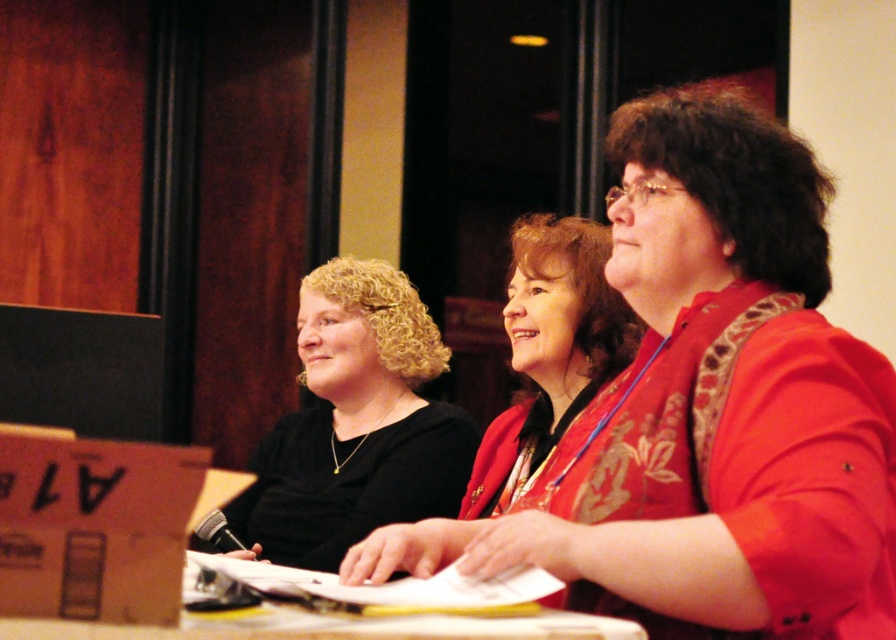
Measure the distance from matte red jacket at center to white glossy table at lower center.

matte red jacket at center is 76.67 centimeters from white glossy table at lower center.

Is point (541, 248) farther from viewer compared to point (214, 621)?

Yes, point (541, 248) is farther from viewer.

Identify the location of matte red jacket at center. (550, 349).

Who is shorter, black matte shirt at center or matte red jacket at center?

Standing shorter between the two is matte red jacket at center.

The width and height of the screenshot is (896, 640). In order to click on black matte shirt at center in this screenshot , I will do `click(355, 424)`.

Identify the location of black matte shirt at center. The width and height of the screenshot is (896, 640). point(355,424).

Between matte red blouse at center and matte red jacket at center, which one has more height?

matte red blouse at center

Which is above, matte red blouse at center or matte red jacket at center?

Positioned higher is matte red blouse at center.

Where is `matte red blouse at center`? This screenshot has height=640, width=896. matte red blouse at center is located at coordinates (722, 400).